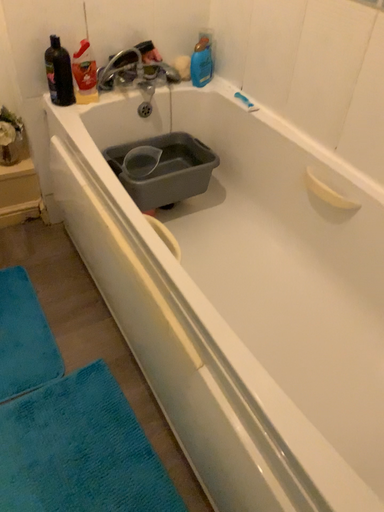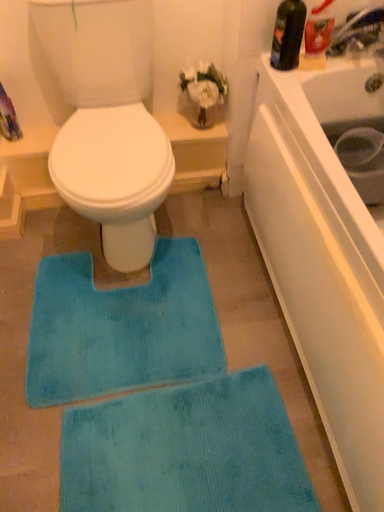
Question: Which way did the camera rotate in the video?

Choices:
 (A) rotated left
 (B) rotated right

Answer: (A)